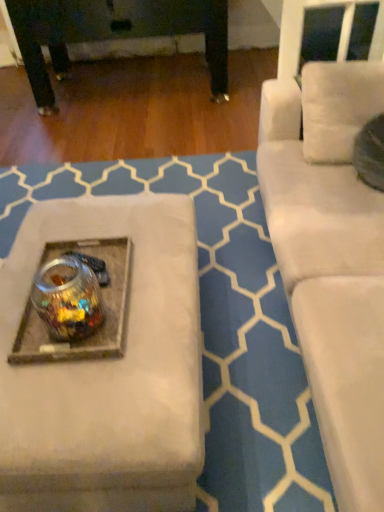
Question: In the image, is clear glass jar at center on the left side or the right side of transparent glass jar at center?

Choices:
 (A) left
 (B) right

Answer: (A)

Question: Looking at the image, does clear glass jar at center seem bigger or smaller compared to transparent glass jar at center?

Choices:
 (A) small
 (B) big

Answer: (A)

Question: Considering their positions, is clear glass jar at center located in front of or behind transparent glass jar at center?

Choices:
 (A) front
 (B) behind

Answer: (B)

Question: In the image, is transparent glass jar at center positioned in front of or behind clear glass jar at center?

Choices:
 (A) front
 (B) behind

Answer: (A)

Question: From the image's perspective, relative to clear glass jar at center, is transparent glass jar at center above or below?

Choices:
 (A) above
 (B) below

Answer: (B)

Question: Is point (51, 285) closer or farther from the camera than point (72, 248)?

Choices:
 (A) farther
 (B) closer

Answer: (B)

Question: Considering the positions of transparent glass jar at center and clear glass jar at center in the image, is transparent glass jar at center taller or shorter than clear glass jar at center?

Choices:
 (A) tall
 (B) short

Answer: (A)